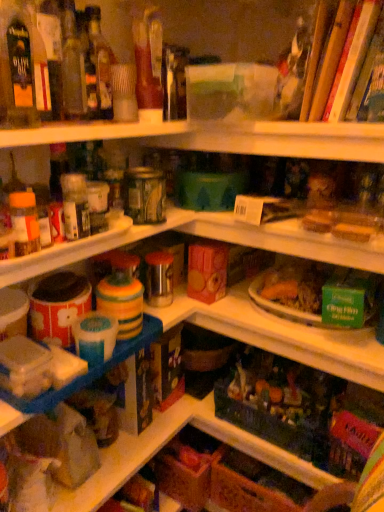
This screenshot has width=384, height=512. What do you see at coordinates (356, 54) in the screenshot?
I see `wooden sticks at upper right` at bounding box center [356, 54].

What is the approximate width of translucent glass bottle at upper left, placed as the 1th bottle when sorted from right to left?

translucent glass bottle at upper left, placed as the 1th bottle when sorted from right to left, is 1.75 inches in width.

Identify the location of matte glass bottle at upper left, the second bottle from the right. (17, 65).

Looking at this image, which is in front, wooden sticks at upper right or translucent glass bottle at upper left, the 2th bottle in the left-to-right sequence?

wooden sticks at upper right is closer to the camera.

Considering the positions of objects wooden sticks at upper right and translucent glass bottle at upper left, placed as the 1th bottle when sorted from right to left, in the image provided, who is more to the right, wooden sticks at upper right or translucent glass bottle at upper left, placed as the 1th bottle when sorted from right to left,?

From the viewer's perspective, wooden sticks at upper right appears more on the right side.

What's the angular difference between wooden sticks at upper right and translucent glass bottle at upper left, placed as the 1th bottle when sorted from right to left,'s facing directions?

87.4 degrees.

Does wooden sticks at upper right turn towards translucent glass bottle at upper left, the 2th bottle in the left-to-right sequence?

No, wooden sticks at upper right is not aimed at translucent glass bottle at upper left, the 2th bottle in the left-to-right sequence.

Consider the image. Which object is closer to the camera, translucent glass bottle at upper left, placed as the 1th bottle when sorted from right to left, or wooden sticks at upper right?

wooden sticks at upper right is more forward.

Which is behind, point (96, 93) or point (322, 84)?

The point (322, 84) is more distant.

Does translucent glass bottle at upper left, the 2th bottle in the left-to-right sequence, have a greater width compared to wooden sticks at upper right?

No, translucent glass bottle at upper left, the 2th bottle in the left-to-right sequence, is not wider than wooden sticks at upper right.

From a real-world perspective, is translucent glass bottle at upper left, which ranks as the second bottle in front-to-back order, located higher than wooden sticks at upper right?

No.

From a real-world perspective, does matte glass bottle at upper left, the second bottle from the right, stand above wooden sticks at upper right?

Indeed, from a real-world perspective, matte glass bottle at upper left, the second bottle from the right, stands above wooden sticks at upper right.

Where is `book behind the matte glass bottle at upper left, the first bottle viewed from the left`? book behind the matte glass bottle at upper left, the first bottle viewed from the left is located at coordinates (356, 54).

Does point (29, 25) come in front of point (318, 118)?

Yes.

Would you consider matte glass bottle at upper left, which is the 1th bottle from front to back, to be distant from wooden sticks at upper right?

No.

Looking at this image, which is closer, (329, 73) or (17, 72)?

Point (329, 73).

Which of these two, wooden sticks at upper right or matte glass bottle at upper left, the second bottle from the right, is bigger?

Bigger between the two is wooden sticks at upper right.

Where is `bottle located in front of the wooden sticks at upper right`? This screenshot has width=384, height=512. bottle located in front of the wooden sticks at upper right is located at coordinates (17, 65).

In the image, is translucent glass bottle at upper left, the 2th bottle in the left-to-right sequence, positioned in front of or behind matte glass bottle at upper left, which is the 1th bottle from front to back?

translucent glass bottle at upper left, the 2th bottle in the left-to-right sequence, is positioned farther from the viewer than matte glass bottle at upper left, which is the 1th bottle from front to back.

From the image's perspective, is translucent glass bottle at upper left, which ranks as the second bottle in front-to-back order, located above matte glass bottle at upper left, marked as the second bottle in a back-to-front arrangement?

Yes, from the image's perspective, translucent glass bottle at upper left, which ranks as the second bottle in front-to-back order, is on top of matte glass bottle at upper left, marked as the second bottle in a back-to-front arrangement.

Which point is more distant from viewer, (101, 38) or (26, 31)?

The point (101, 38) is more distant.

Looking at the image, does translucent glass bottle at upper left, which ranks as the second bottle in front-to-back order, seem bigger or smaller compared to matte glass bottle at upper left, marked as the second bottle in a back-to-front arrangement?

Clearly, translucent glass bottle at upper left, which ranks as the second bottle in front-to-back order, is smaller in size than matte glass bottle at upper left, marked as the second bottle in a back-to-front arrangement.

In the scene shown: Is matte glass bottle at upper left, which is the 1th bottle from front to back, positioned before translucent glass bottle at upper left, the 2th bottle in the left-to-right sequence?

That is True.

From the picture: How many degrees apart are the facing directions of matte glass bottle at upper left, marked as the second bottle in a back-to-front arrangement, and translucent glass bottle at upper left, positioned as the first bottle in back-to-front order?

The angle between the facing direction of matte glass bottle at upper left, marked as the second bottle in a back-to-front arrangement, and the facing direction of translucent glass bottle at upper left, positioned as the first bottle in back-to-front order, is 2.86 degrees.

Considering the relative sizes of matte glass bottle at upper left, the first bottle viewed from the left, and translucent glass bottle at upper left, positioned as the first bottle in back-to-front order, in the image provided, is matte glass bottle at upper left, the first bottle viewed from the left, taller than translucent glass bottle at upper left, positioned as the first bottle in back-to-front order,?

Indeed, matte glass bottle at upper left, the first bottle viewed from the left, has a greater height compared to translucent glass bottle at upper left, positioned as the first bottle in back-to-front order.

Does matte glass bottle at upper left, the first bottle viewed from the left, touch translucent glass bottle at upper left, the 2th bottle in the left-to-right sequence?

No, matte glass bottle at upper left, the first bottle viewed from the left, is not making contact with translucent glass bottle at upper left, the 2th bottle in the left-to-right sequence.

In the image, there is a translucent glass bottle at upper left, which ranks as the second bottle in front-to-back order. At what (x,y) coordinates should I click in order to perform the action: click on book above it (from the image's perspective). Please return your answer as a coordinate pair (x, y). This screenshot has width=384, height=512. Looking at the image, I should click on (356, 54).

At what (x,y) coordinates should I click in order to perform the action: click on bottle that is the 1st one when counting downward from the wooden sticks at upper right (from the image's perspective). Please return your answer as a coordinate pair (x, y). The width and height of the screenshot is (384, 512). Looking at the image, I should click on (99, 62).

Which object lies further to the anchor point translucent glass bottle at upper left, positioned as the first bottle in back-to-front order, matte glass bottle at upper left, marked as the second bottle in a back-to-front arrangement, or wooden sticks at upper right?

The object further to translucent glass bottle at upper left, positioned as the first bottle in back-to-front order, is wooden sticks at upper right.

When comparing their distances from matte glass bottle at upper left, the first bottle viewed from the left, does translucent glass bottle at upper left, the 2th bottle in the left-to-right sequence, or wooden sticks at upper right seem closer?

translucent glass bottle at upper left, the 2th bottle in the left-to-right sequence, is closer to matte glass bottle at upper left, the first bottle viewed from the left.

Which object lies further to the anchor point matte glass bottle at upper left, the second bottle from the right, wooden sticks at upper right or translucent glass bottle at upper left, positioned as the first bottle in back-to-front order?

Among the two, wooden sticks at upper right is located further to matte glass bottle at upper left, the second bottle from the right.

Based on the photo, from the image, which object appears to be nearer to translucent glass bottle at upper left, which ranks as the second bottle in front-to-back order, wooden sticks at upper right or matte glass bottle at upper left, marked as the second bottle in a back-to-front arrangement?

matte glass bottle at upper left, marked as the second bottle in a back-to-front arrangement.

Considering their positions, is translucent glass bottle at upper left, positioned as the first bottle in back-to-front order, positioned closer to wooden sticks at upper right than matte glass bottle at upper left, the second bottle from the right?

translucent glass bottle at upper left, positioned as the first bottle in back-to-front order, is positioned closer to the anchor wooden sticks at upper right.

From the image, which object appears to be nearer to wooden sticks at upper right, matte glass bottle at upper left, which is the 1th bottle from front to back, or translucent glass bottle at upper left, placed as the 1th bottle when sorted from right to left?

Based on the image, translucent glass bottle at upper left, placed as the 1th bottle when sorted from right to left, appears to be nearer to wooden sticks at upper right.

You are a GUI agent. You are given a task and a screenshot of the screen. Output one action in this format:
    pyautogui.click(x=<x>, y=<y>)
    Task: Click on the bottle situated between matte glass bottle at upper left, the first bottle viewed from the left, and wooden sticks at upper right from left to right
    
    Given the screenshot: What is the action you would take?
    pyautogui.click(x=99, y=62)